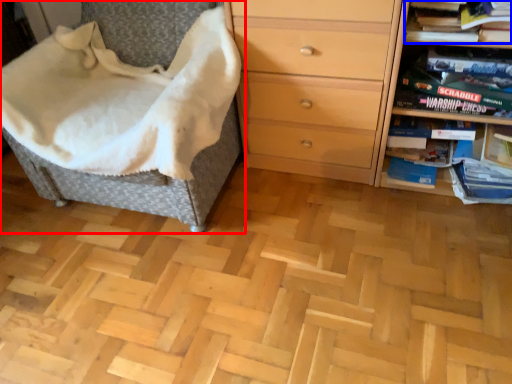
Question: Which object appears closest to the camera in this image, furniture (highlighted by a red box) or book (highlighted by a blue box)?

Choices:
 (A) furniture
 (B) book

Answer: (A)